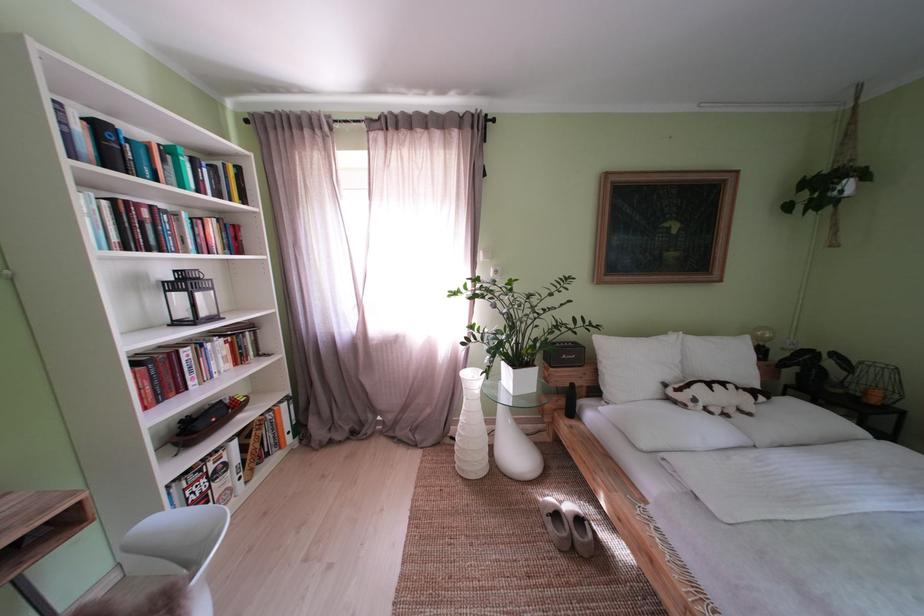
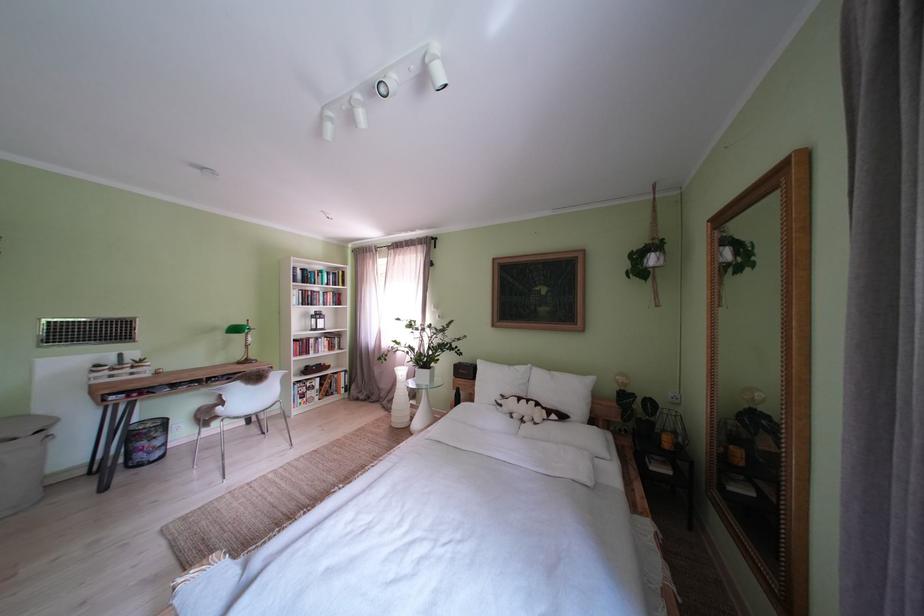
The point at (429, 443) is marked in the first image. Where is the corresponding point in the second image?

(400, 411)